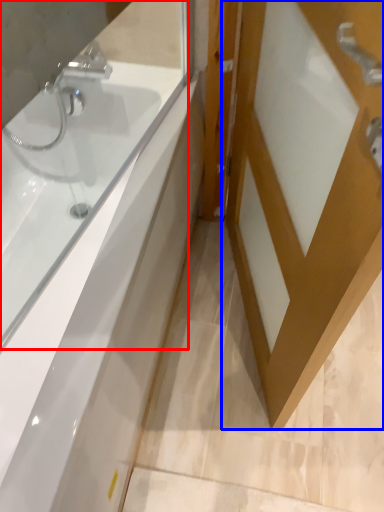
Question: Among these objects, which one is nearest to the camera, bathtub (highlighted by a red box) or door (highlighted by a blue box)?

Choices:
 (A) bathtub
 (B) door

Answer: (B)